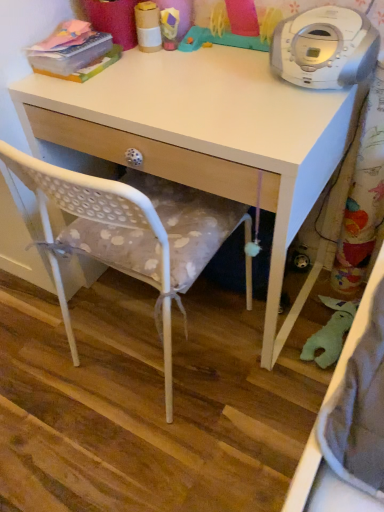
I want to click on free spot below rubber duck at upper center, which is the first toy from right to left (from a real-world perspective), so click(225, 54).